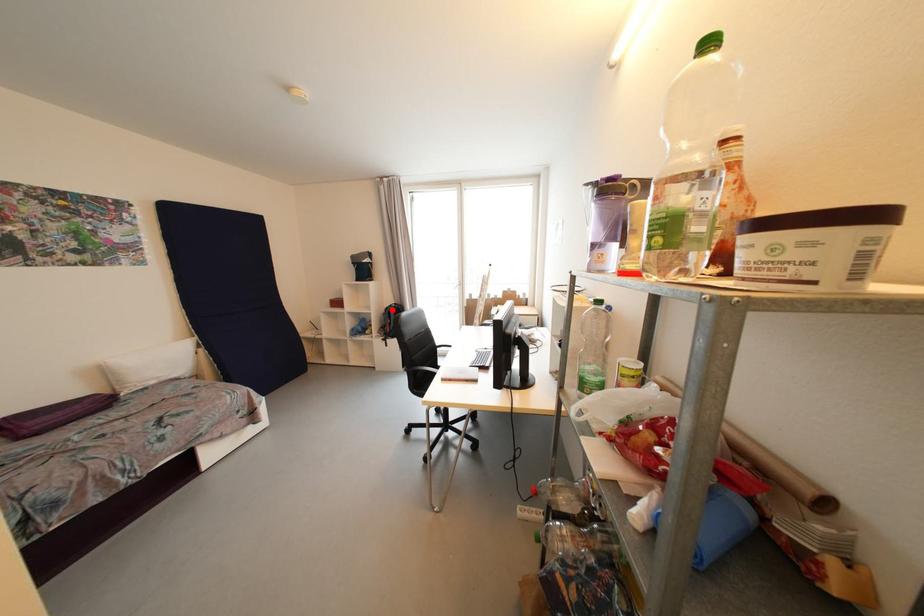
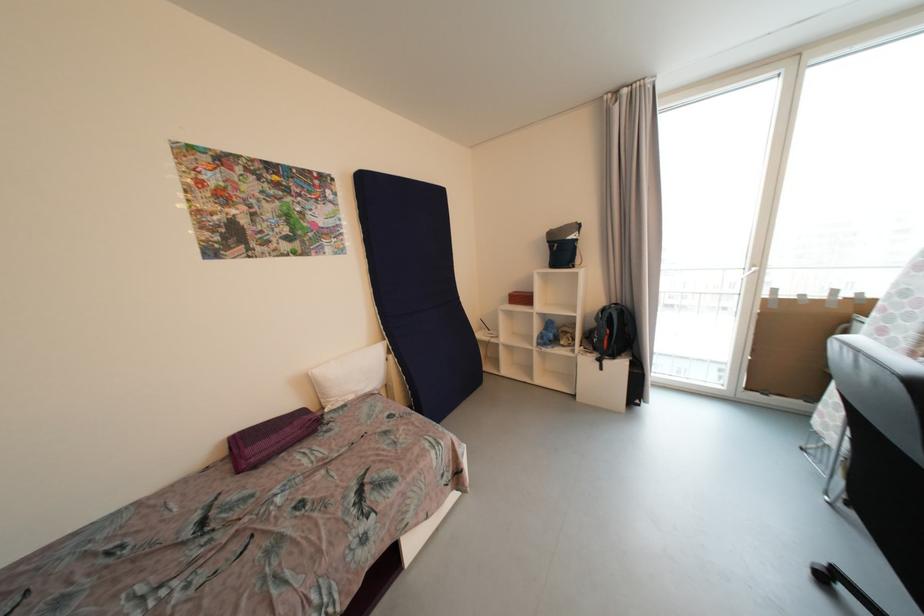
Where in the second image is the point corresponding to the highlighted location from the first image?

(608, 312)